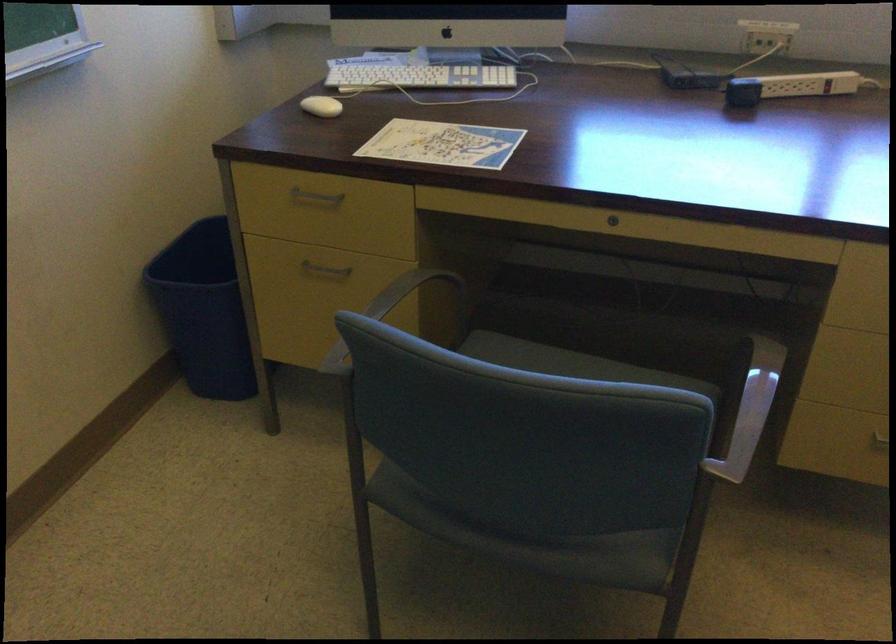
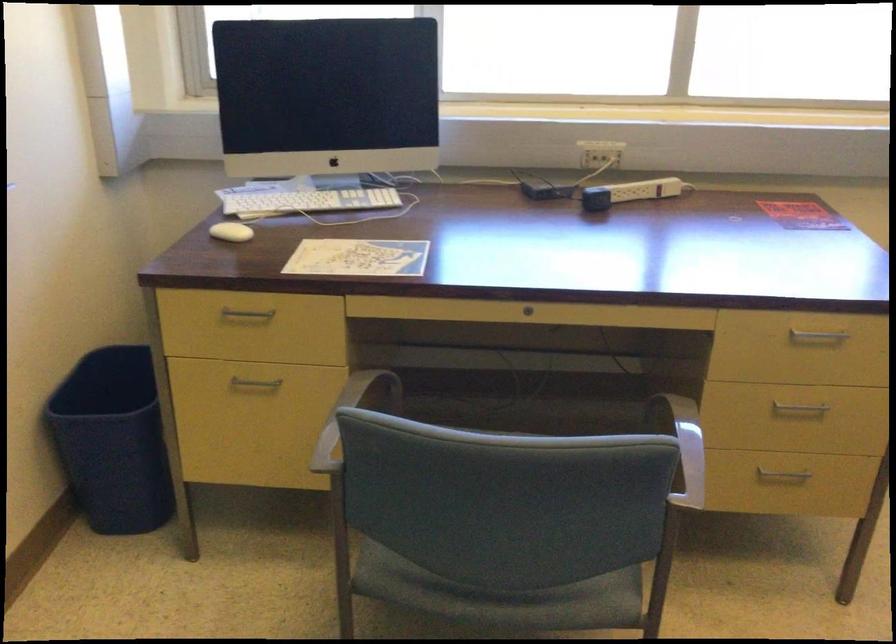
Where in the second image is the point corresponding to pixel 321 269 from the first image?

(254, 384)